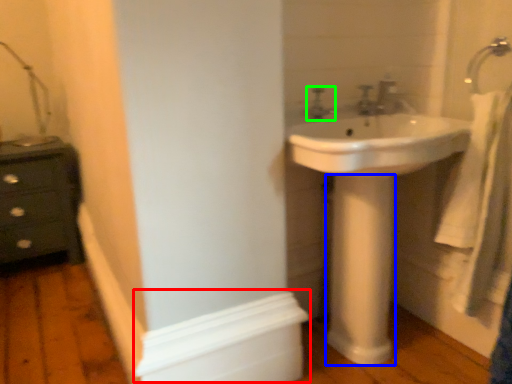
Question: Which is nearer to the molding (highlighted by a red box)? pillar (highlighted by a blue box) or tap (highlighted by a green box).

Choices:
 (A) pillar
 (B) tap

Answer: (A)